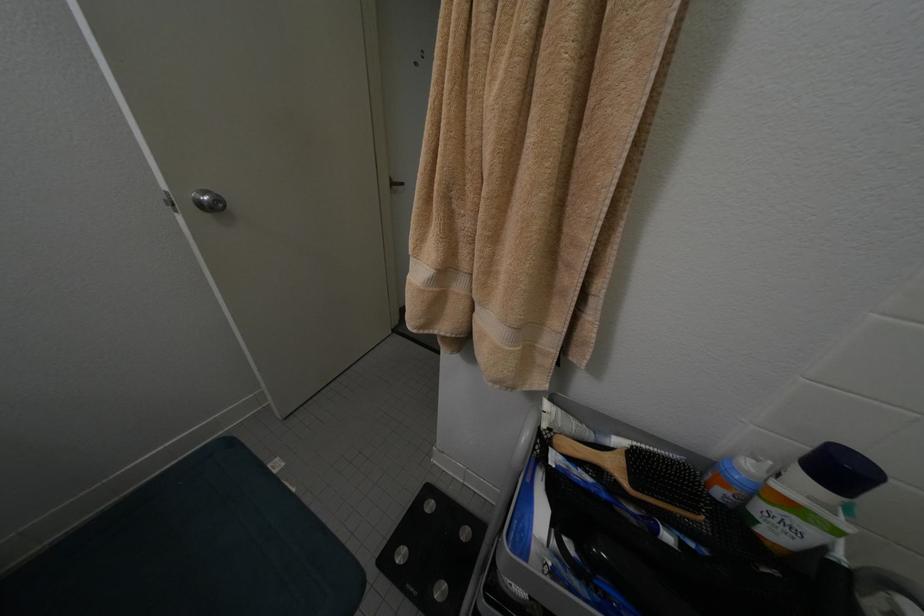
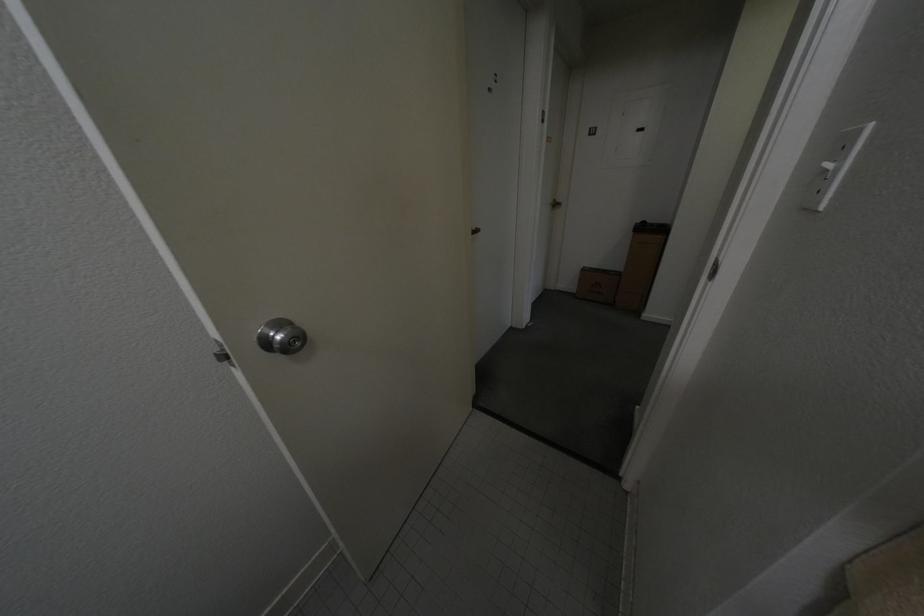
Question: The camera is either moving clockwise (left) or counter-clockwise (right) around the object. The first image is from the beginning of the video and the second image is from the end. Is the camera moving left or right when shooting the video?

Choices:
 (A) Left
 (B) Right

Answer: (B)